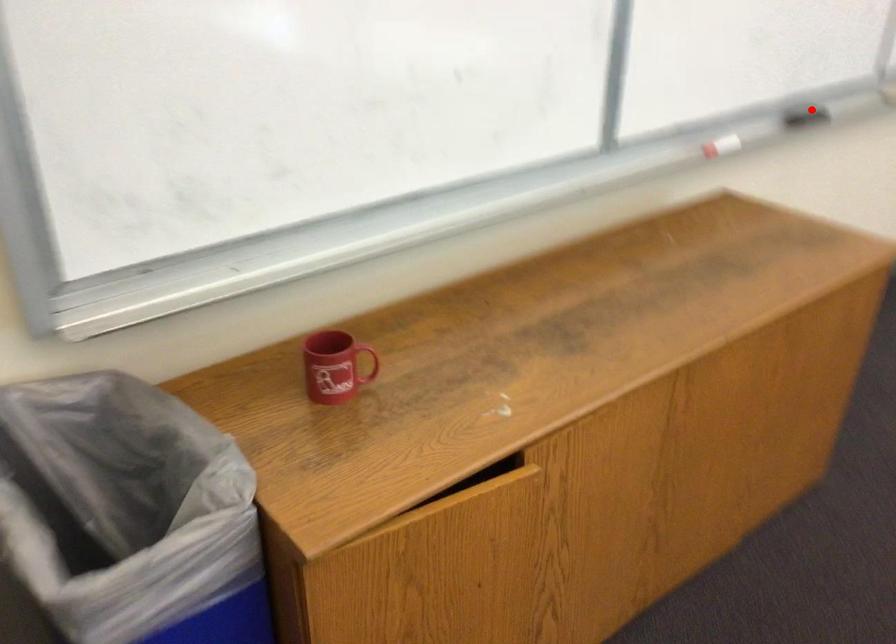
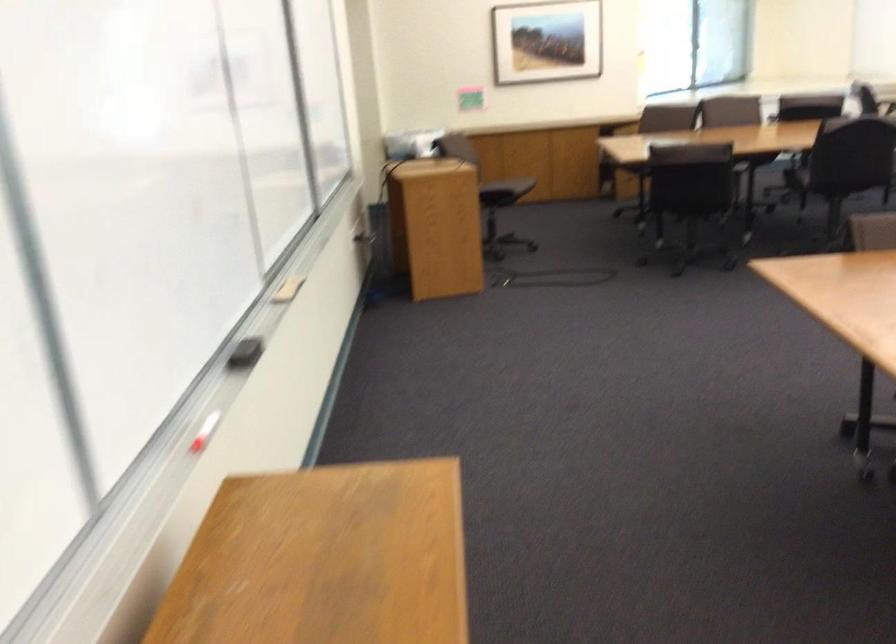
Question: I am providing you with two images of the same scene from different viewpoints. In image1, a red point is highlighted. Considering the same 3D point in image2, which of the following is correct?

Choices:
 (A) It is closer
 (B) It is farther

Answer: (A)